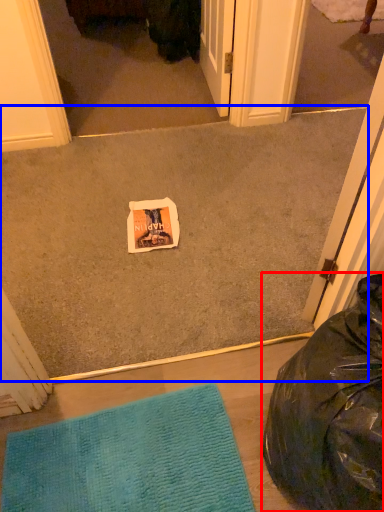
Question: Which object is further to the camera taking this photo, bean bag chair (highlighted by a red box) or concrete (highlighted by a blue box)?

Choices:
 (A) bean bag chair
 (B) concrete

Answer: (B)